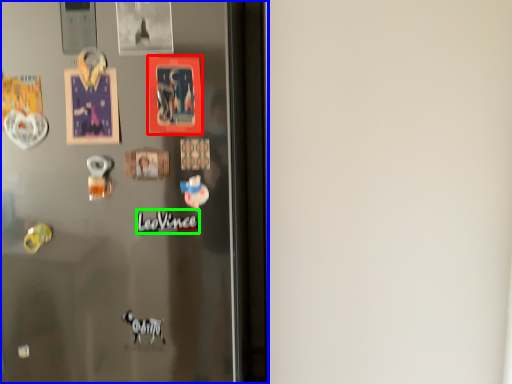
Question: Estimate the real-world distances between objects in this image. Which object is farther from postcard (highlighted by a red box), refrigerator (highlighted by a blue box) or writing (highlighted by a green box)?

Choices:
 (A) refrigerator
 (B) writing

Answer: (A)